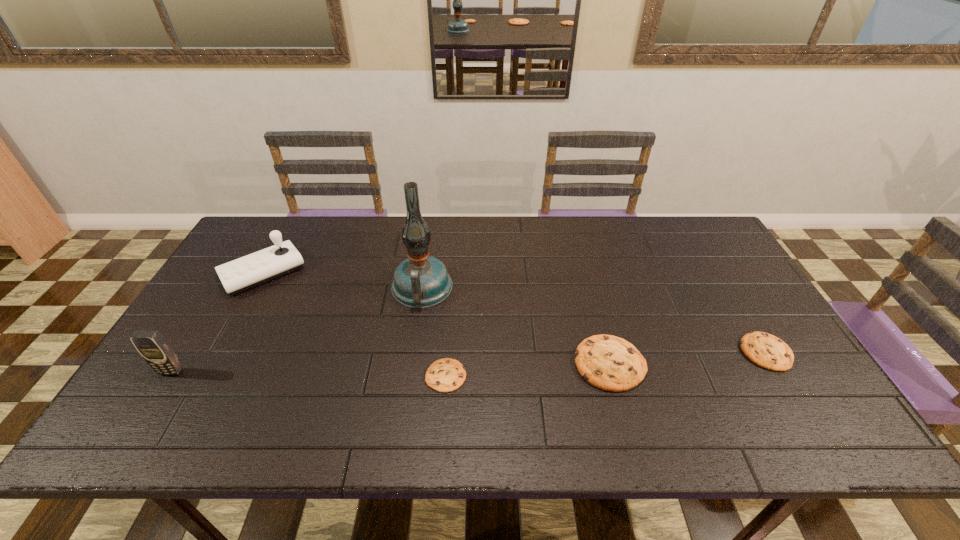
The image size is (960, 540). Identify the location of vacant space located 0.240m on the right of the fifth object from left to right. (740, 363).

Image resolution: width=960 pixels, height=540 pixels. I want to click on vacant area located on the left of the rightmost object, so click(634, 352).

You are a GUI agent. You are given a task and a screenshot of the screen. Output one action in this format:
    pyautogui.click(x=<x>, y=<y>)
    Task: Click on the free space located on the left of the oil lamp
    Image resolution: width=960 pixels, height=540 pixels.
    Given the screenshot: What is the action you would take?
    [321, 288]

Identify the location of vacant area situated on the right of the joystick. The height and width of the screenshot is (540, 960). (401, 273).

Locate an element on the screen. This screenshot has height=540, width=960. object that is at the far edge is located at coordinates (246, 272).

In order to click on cellular telephone situated at the near edge in this screenshot , I will do `click(157, 352)`.

Image resolution: width=960 pixels, height=540 pixels. Identify the location of cellular telephone that is positioned at the left edge. (157, 352).

The width and height of the screenshot is (960, 540). I want to click on joystick that is at the left edge, so click(246, 272).

Locate an element on the screen. The width and height of the screenshot is (960, 540). object positioned at the right edge is located at coordinates (766, 350).

In order to click on object that is at the far left corner in this screenshot , I will do `click(246, 272)`.